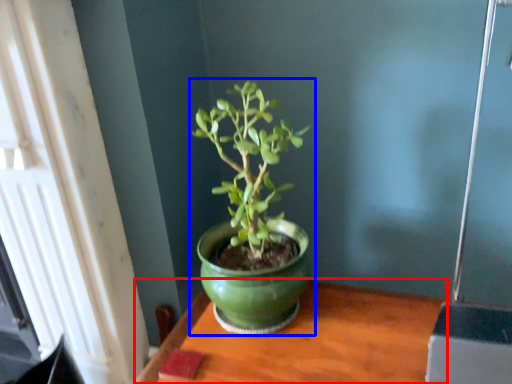
Question: Which object is closer to the camera taking this photo, table (highlighted by a red box) or houseplant (highlighted by a blue box)?

Choices:
 (A) table
 (B) houseplant

Answer: (A)